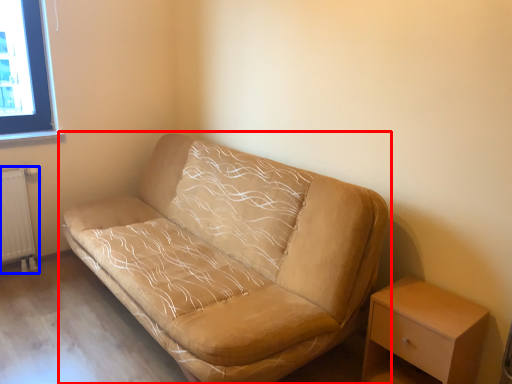
Question: Which of the following is the closest to the observer, studio couch (highlighted by a red box) or radiator (highlighted by a blue box)?

Choices:
 (A) studio couch
 (B) radiator

Answer: (A)